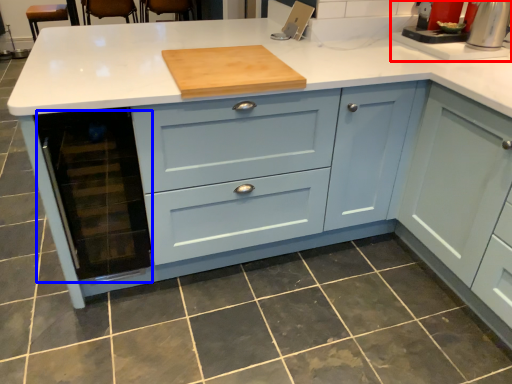
Question: Among these objects, which one is farthest to the camera, sink (highlighted by a red box) or appliance (highlighted by a blue box)?

Choices:
 (A) sink
 (B) appliance

Answer: (A)